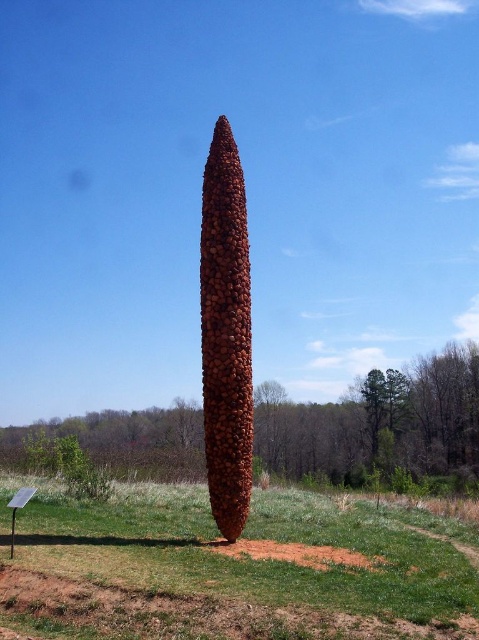
Question: Is green grass at center above brown textured sculpture at center?

Choices:
 (A) no
 (B) yes

Answer: (B)

Question: Which of the following is the closest to the observer?

Choices:
 (A) (228, 195)
 (B) (405, 392)
 (C) (446, 612)

Answer: (C)

Question: Does green grass at center have a greater width compared to brown textured sculpture at center?

Choices:
 (A) yes
 (B) no

Answer: (B)

Question: Does green grass at center have a greater width compared to brown textured pine cone at center?

Choices:
 (A) no
 (B) yes

Answer: (B)

Question: Which object appears closest to the camera in this image?

Choices:
 (A) brown textured sculpture at center
 (B) green grass at center
 (C) brown textured pine cone at center

Answer: (B)

Question: Which is nearer to the brown textured pine cone at center?

Choices:
 (A) green grass at center
 (B) brown textured sculpture at center

Answer: (A)